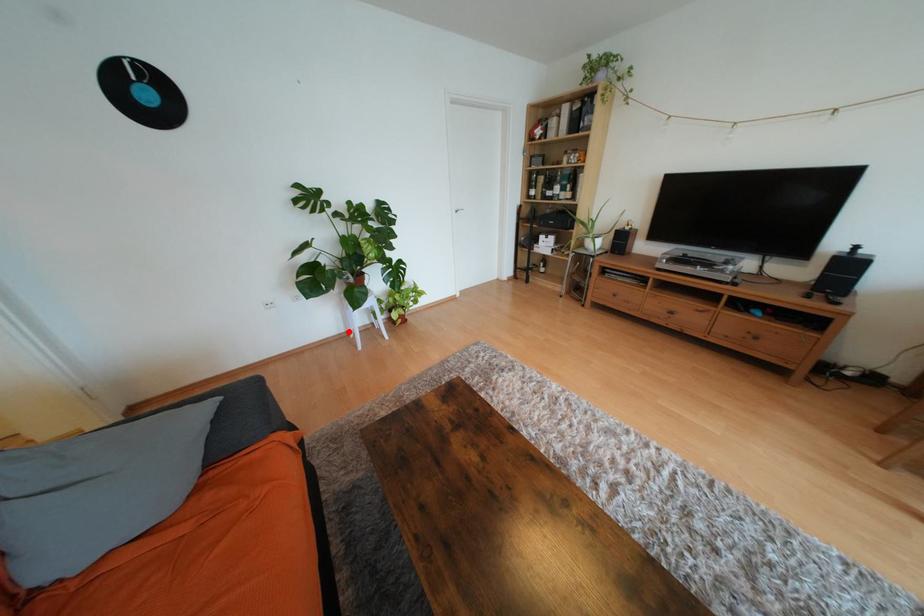
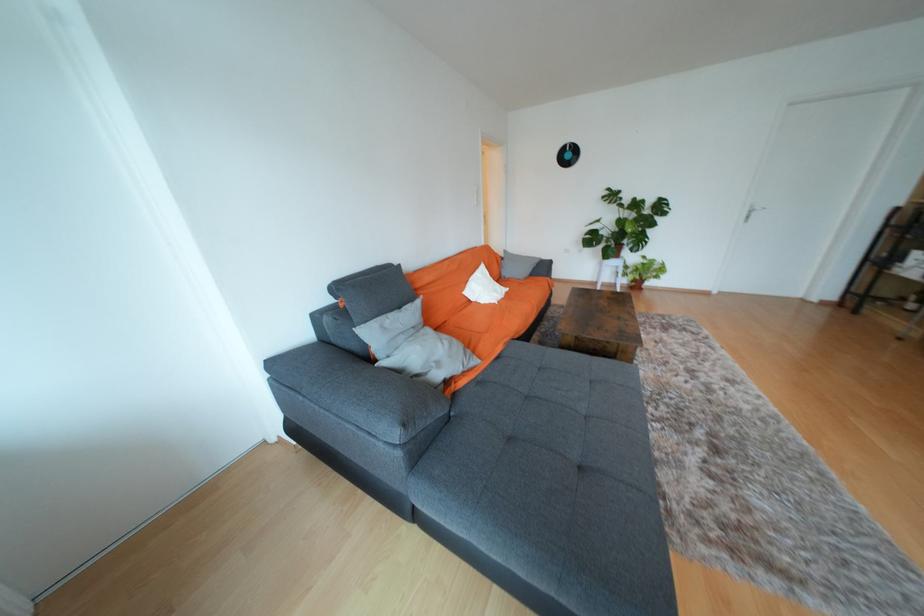
Question: I am providing you with two images of the same scene from different viewpoints. Given a red point in image1, look at the same physical point in image2. Is it:

Choices:
 (A) Closer to the viewpoint
 (B) Farther from the viewpoint

Answer: (B)